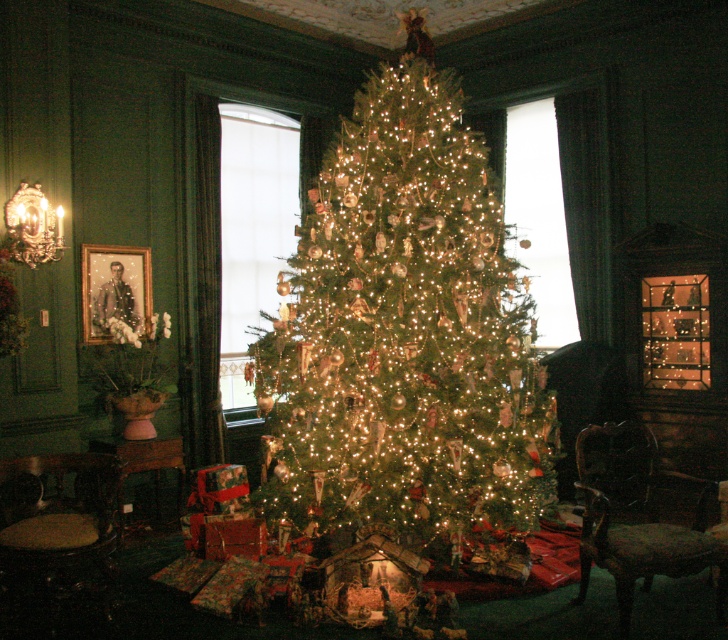
Does green textured christmas tree at center have a greater width compared to dark brown leather armchair at lower left?

Yes.

From the picture: Can you confirm if green textured christmas tree at center is positioned below dark brown leather armchair at lower left?

No.

Find the location of a particular element. The height and width of the screenshot is (640, 728). green textured christmas tree at center is located at coordinates (403, 336).

Who is more distant from viewer, (400, 230) or (680, 531)?

The point (400, 230) is more distant.

This screenshot has height=640, width=728. Find the location of `green textured christmas tree at center`. green textured christmas tree at center is located at coordinates (403, 336).

At what (x,y) coordinates should I click in order to perform the action: click on green textured christmas tree at center. Please return your answer as a coordinate pair (x, y). Looking at the image, I should click on [403, 336].

From the picture: Is the position of wooden armchair at lower right more distant than that of dark brown leather armchair at lower left?

No, wooden armchair at lower right is in front of dark brown leather armchair at lower left.

Describe the element at coordinates (638, 509) in the screenshot. The height and width of the screenshot is (640, 728). I see `wooden armchair at lower right` at that location.

Image resolution: width=728 pixels, height=640 pixels. In order to click on wooden armchair at lower right in this screenshot , I will do `click(638, 509)`.